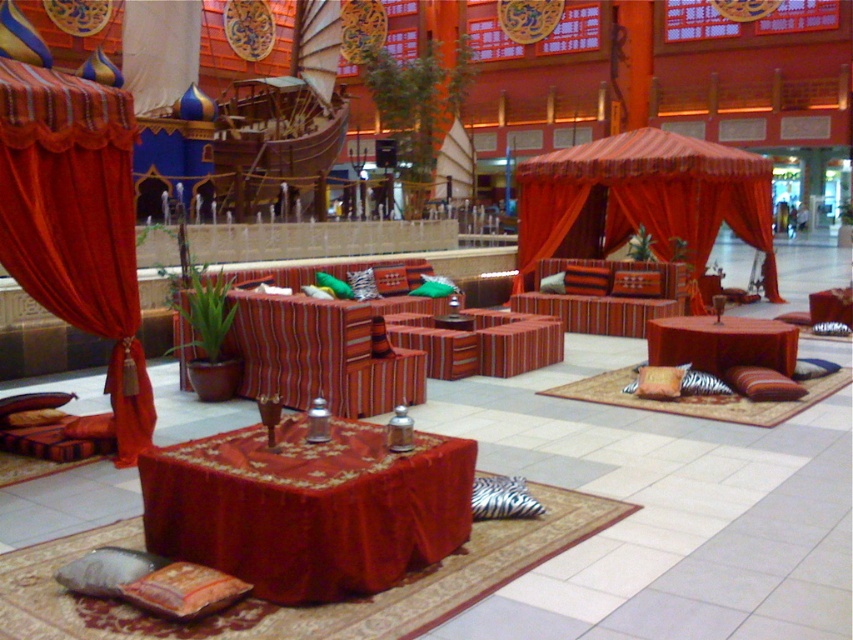
Question: Which point is farther to the camera?

Choices:
 (A) striped fabric couch at center
 (B) matte red fabric canopy bed at center
 (C) velvet red curtain at left

Answer: (B)

Question: Can you confirm if matte red fabric canopy bed at center is smaller than velvet red table at center?

Choices:
 (A) no
 (B) yes

Answer: (B)

Question: Is velvet red tablecloth at center bigger than striped fabric couch at center?

Choices:
 (A) no
 (B) yes

Answer: (A)

Question: Which of the following is the closest to the observer?

Choices:
 (A) (212, 500)
 (B) (711, 208)
 (C) (744, 330)
 (D) (106, 208)

Answer: (A)

Question: Does velvet red tablecloth at center have a smaller size compared to velvet red curtain at left?

Choices:
 (A) yes
 (B) no

Answer: (A)

Question: Which of the following is the closest to the observer?

Choices:
 (A) (660, 275)
 (B) (608, 212)

Answer: (A)